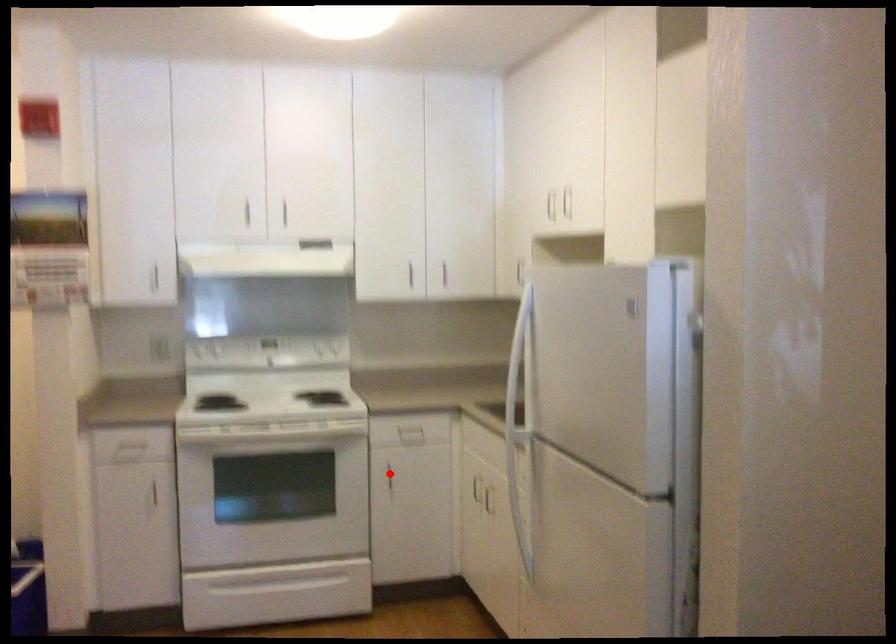
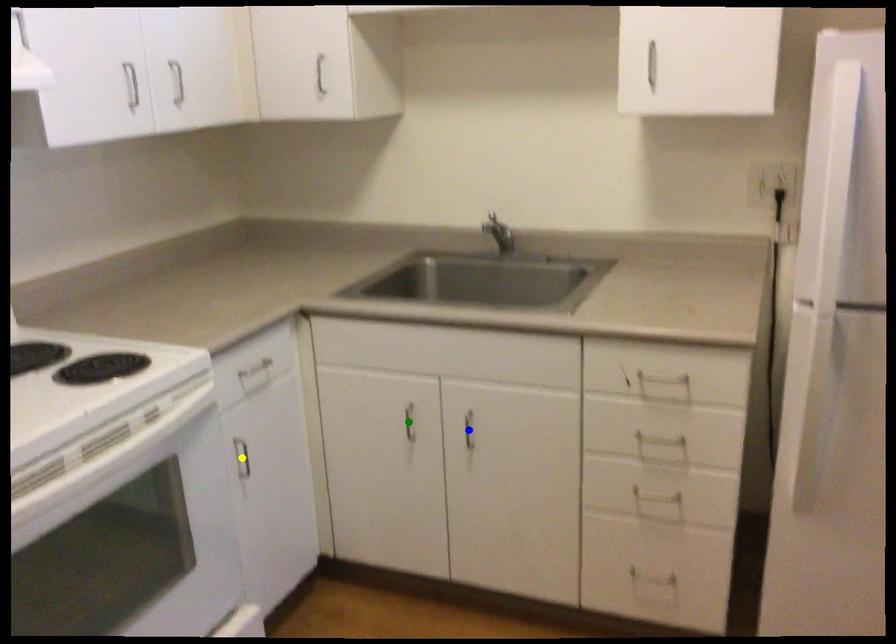
Question: I am providing you with two images of the same scene from different viewpoints. A red point is marked on the first image. You are given multiple points on the second image. Which point in image 2 represents the same 3d spot as the red point in image 1?

Choices:
 (A) green point
 (B) yellow point
 (C) blue point

Answer: (B)